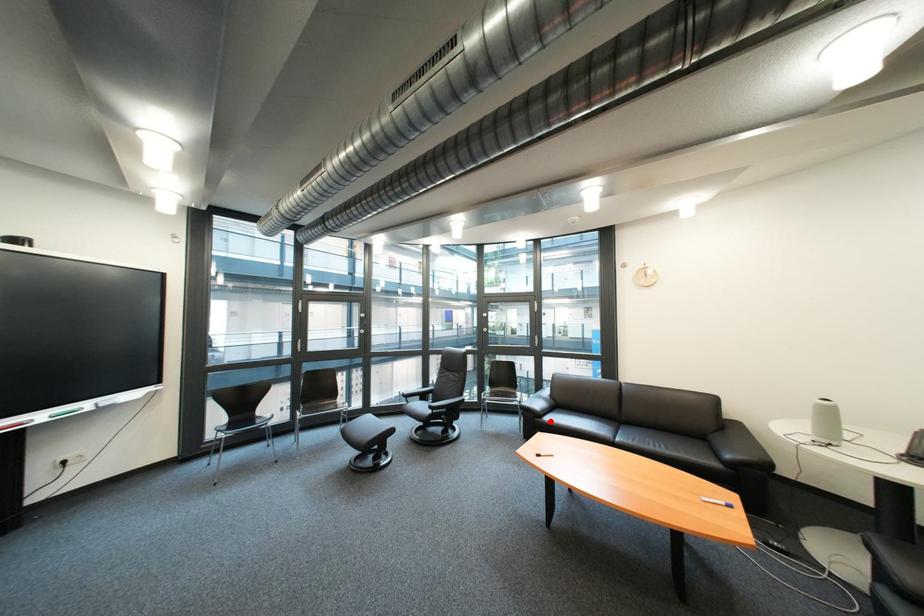
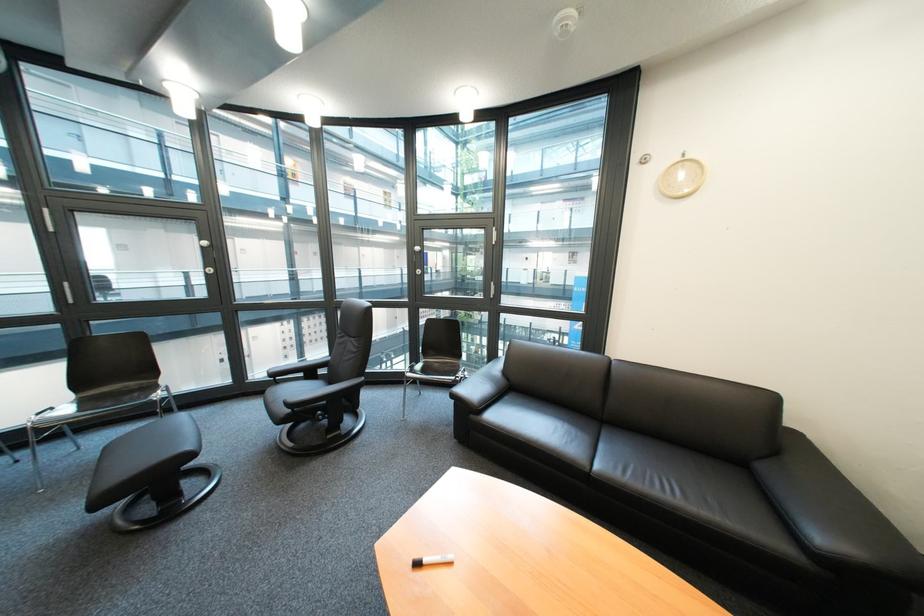
The point at the highlighted location is marked in the first image. Where is the corresponding point in the second image?

(485, 418)